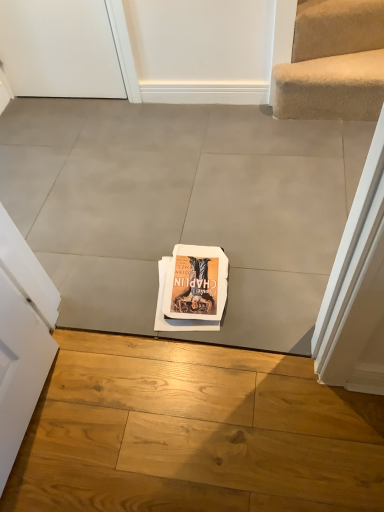
Where is `vacant point to the left of matte paper book at center`? vacant point to the left of matte paper book at center is located at coordinates (114, 292).